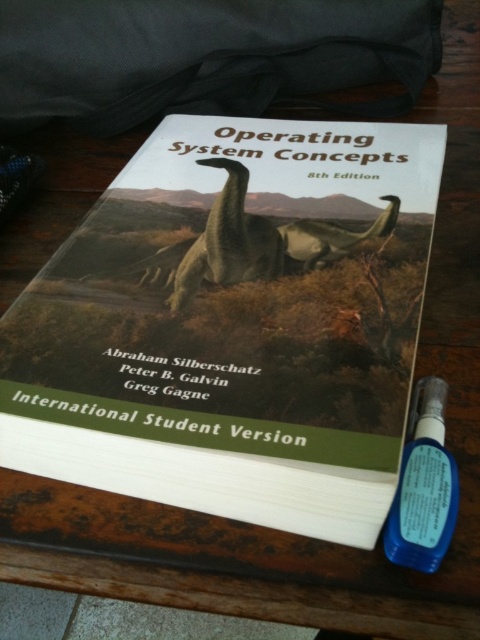
Question: Can you confirm if hardcover book at center is bigger than green matte dinosaur at center?

Choices:
 (A) yes
 (B) no

Answer: (A)

Question: From the image, what is the correct spatial relationship of hardcover book at center in relation to green matte dinosaur at center?

Choices:
 (A) above
 (B) below

Answer: (B)

Question: Among these points, which one is nearest to the camera?

Choices:
 (A) (206, 234)
 (B) (410, 292)

Answer: (B)

Question: Is hardcover book at center to the right of green matte dinosaur at center from the viewer's perspective?

Choices:
 (A) no
 (B) yes

Answer: (B)